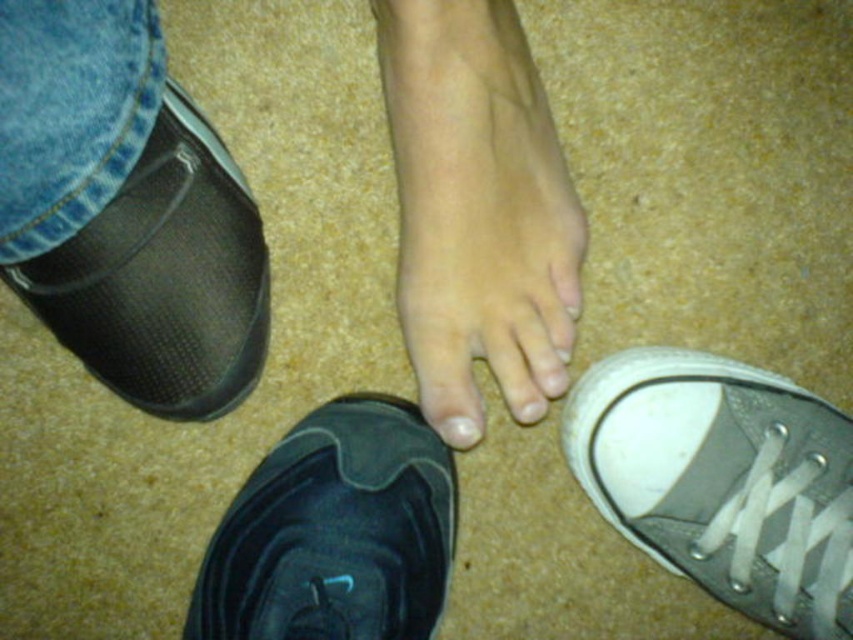
You are a physical therapist assessing a patient who is practicing balance exercises. The patient has a black mesh shoe at lower left and a white matte nail at center. You need to place a balance pad between them. What is the minimum length of the balance pad required to fit between the two objects?

The distance between the black mesh shoe at lower left and the white matte nail at center is 11.64 inches, so the minimum length of the balance pad required is at least 11.64 inches to fit between them.

You are a shoe salesperson helping a customer choose the right size. The customer has a skinny white foot at center and a gray canvas shoe at lower right. Which object is bigger in size?

The skinny white foot at center is bigger in size compared to the gray canvas shoe at lower right.

Based on the photo, you are a stylist preparing to take a photo of someone transitioning from wearing shoes to being barefoot. The scene requires the black mesh shoe at lower left and the white matte nail at center to be visible. Which object should you ensure is placed first in the frame to avoid being obscured?

The black mesh shoe at lower left should be placed first since it is bigger than the white matte nail at center, making it less likely to be obscured by the smaller object.